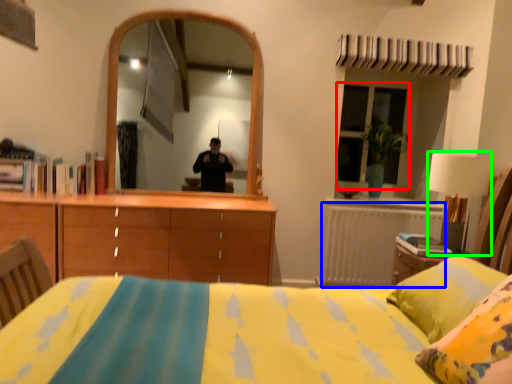
Question: Based on their relative distances, which object is nearer to window (highlighted by a red box)? Choose from radiator (highlighted by a blue box) and table lamp (highlighted by a green box).

Choices:
 (A) radiator
 (B) table lamp

Answer: (A)